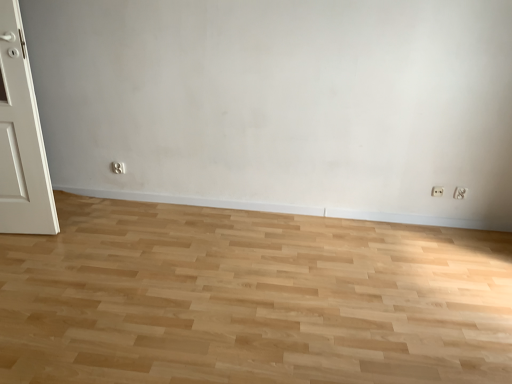
Question: Considering the positions of white plastic electric outlet at lower right, which is counted as the second electric outlet, starting from the right, and white plastic electric outlet at lower right, positioned as the first electric outlet in right-to-left order, in the image, is white plastic electric outlet at lower right, which is counted as the second electric outlet, starting from the right, bigger or smaller than white plastic electric outlet at lower right, positioned as the first electric outlet in right-to-left order,?

Choices:
 (A) small
 (B) big

Answer: (A)

Question: Is point (434, 190) closer or farther from the camera than point (459, 195)?

Choices:
 (A) closer
 (B) farther

Answer: (B)

Question: Which object is positioned farthest from the natural wood floor at center?

Choices:
 (A) white plastic electric outlet at lower right, which ranks as the second electric outlet in left-to-right order
 (B) white plastic electric outlet at lower right, acting as the first electric outlet starting from the left

Answer: (A)

Question: Based on their relative distances, which object is farther from the natural wood floor at center?

Choices:
 (A) white plastic electric outlet at lower right, positioned as the first electric outlet in right-to-left order
 (B) white plastic electric outlet at lower right, which is counted as the second electric outlet, starting from the right

Answer: (A)